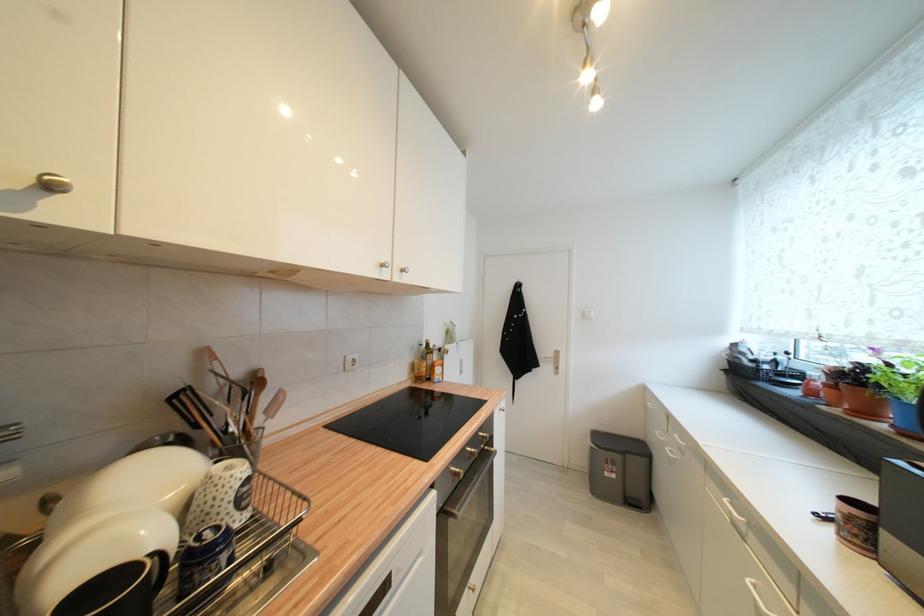
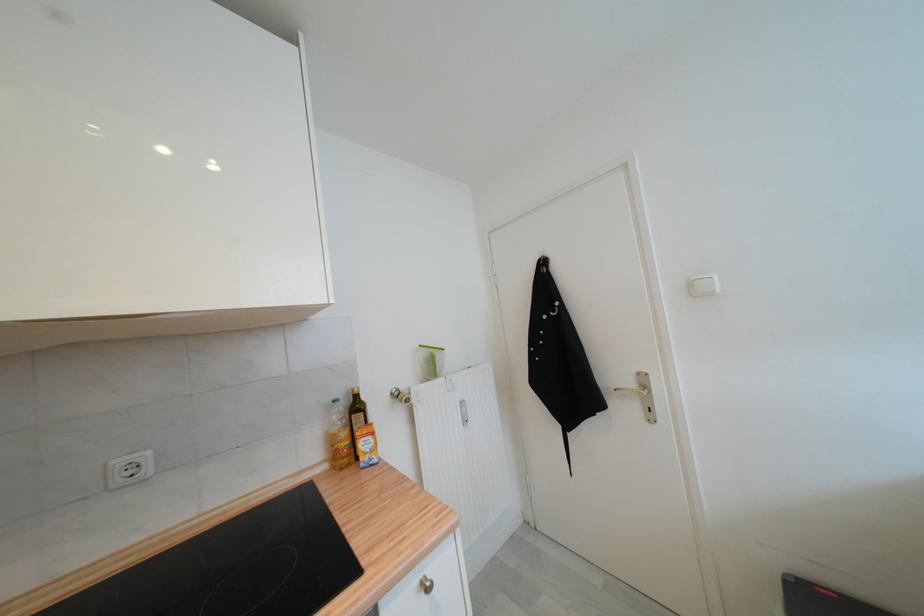
The point at (432, 342) is marked in the first image. Where is the corresponding point in the second image?

(358, 392)